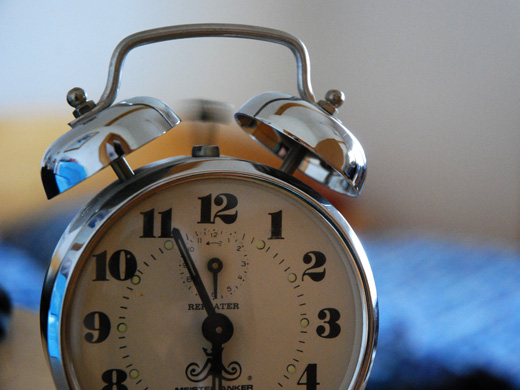
The width and height of the screenshot is (520, 390). I want to click on top of black hour hand on clock, so click(x=215, y=355).